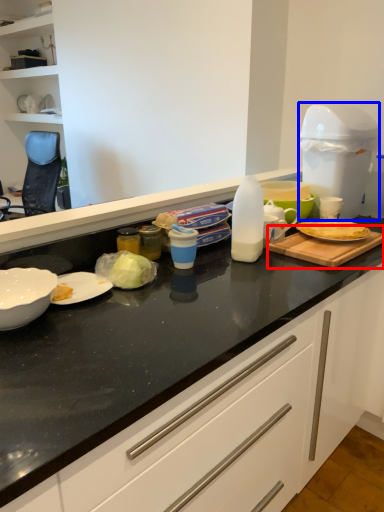
Question: Which of the following is the closest to the observer, cutting board (highlighted by a red box) or appliance (highlighted by a blue box)?

Choices:
 (A) cutting board
 (B) appliance

Answer: (A)